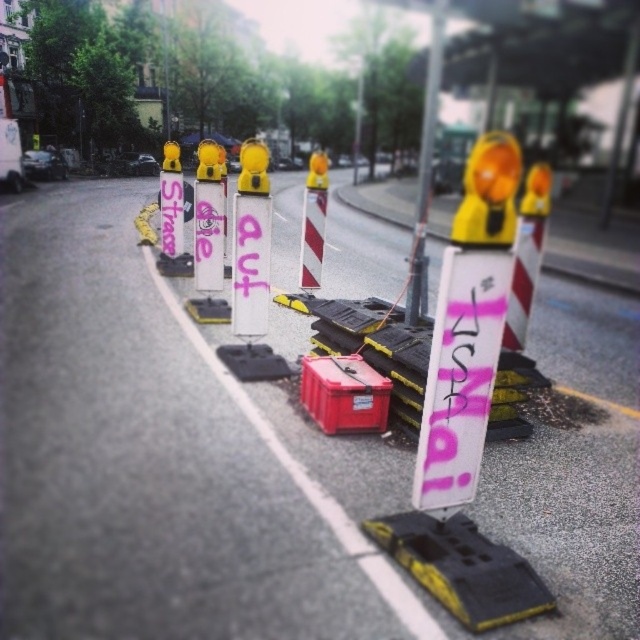
Who is taller, pink matte sign at center or metallic silver car at left?

metallic silver car at left

Is pink matte sign at center smaller than metallic silver car at left?

Yes, pink matte sign at center is smaller than metallic silver car at left.

Measure the distance between pink matte sign at center and camera.

The distance of pink matte sign at center from camera is 10.63 feet.

Where is `pink matte sign at center`? pink matte sign at center is located at coordinates (460, 376).

Can you confirm if metallic silver car at left is positioned above dark gray metallic car at center?

Actually, metallic silver car at left is below dark gray metallic car at center.

Between metallic silver car at left and dark gray metallic car at center, which one has more height?

Standing taller between the two is metallic silver car at left.

The height and width of the screenshot is (640, 640). Find the location of `metallic silver car at left`. metallic silver car at left is located at coordinates (44, 164).

At what (x,y) coordinates should I click in order to perform the action: click on metallic silver car at left. Please return your answer as a coordinate pair (x, y). Looking at the image, I should click on (44, 164).

Who is shorter, pink matte sign at center or white plastic pole at center?

With less height is pink matte sign at center.

Is pink matte sign at center wider than white plastic pole at center?

Incorrect, pink matte sign at center's width does not surpass white plastic pole at center's.

Image resolution: width=640 pixels, height=640 pixels. Describe the element at coordinates (460, 376) in the screenshot. I see `pink matte sign at center` at that location.

The width and height of the screenshot is (640, 640). Identify the location of pink matte sign at center. (460, 376).